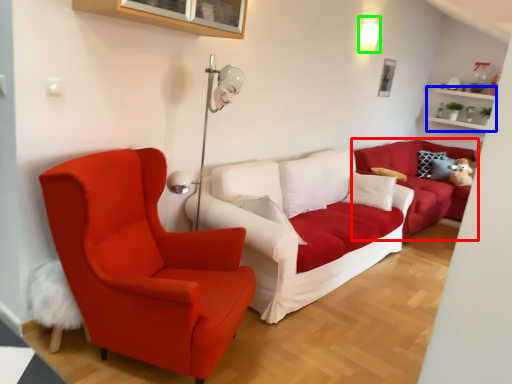
Question: Which object is positioned farthest from studio couch (highlighted by a red box)? Select from shelf (highlighted by a blue box) and light fixture (highlighted by a green box).

Choices:
 (A) shelf
 (B) light fixture

Answer: (A)